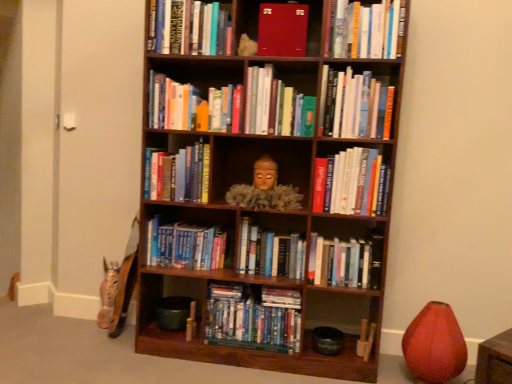
I want to click on vacant space that is to the left of mahogany wood bookcase at center, so click(x=100, y=355).